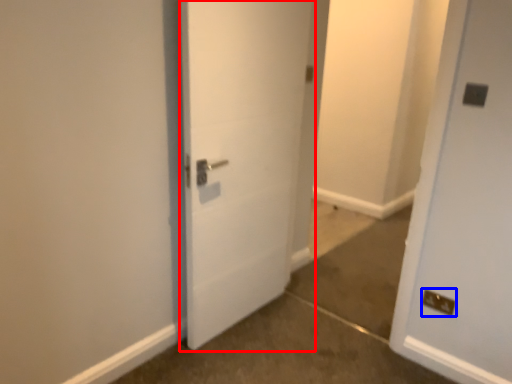
Question: Which point is further to the camera, door (highlighted by a red box) or electric outlet (highlighted by a blue box)?

Choices:
 (A) door
 (B) electric outlet

Answer: (B)